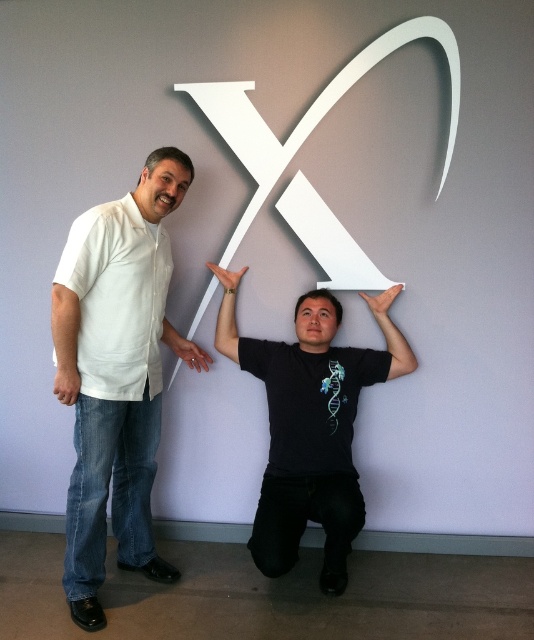
Question: Which of the following is the farthest from the observer?

Choices:
 (A) white matte letter x at center
 (B) matte white hand at center
 (C) white matte paper at upper center

Answer: (B)

Question: Is matte white hand at center thinner than matte white hand at upper center?

Choices:
 (A) yes
 (B) no

Answer: (B)

Question: Estimate the real-world distances between objects in this image. Which object is farther from the white matte letter x at center?

Choices:
 (A) white matte paper at upper center
 (B) matte white hand at upper center
 (C) white cotton shirt at left

Answer: (C)

Question: Is black matte t-shirt at center bigger than white matte letter x at upper center?

Choices:
 (A) yes
 (B) no

Answer: (A)

Question: Which of the following is the closest to the observer?

Choices:
 (A) (172, 349)
 (B) (292, 188)
 (C) (69, 404)
 (D) (292, 492)

Answer: (C)

Question: Is white matte letter x at upper center to the left of white matte letter x at center from the viewer's perspective?

Choices:
 (A) yes
 (B) no

Answer: (A)